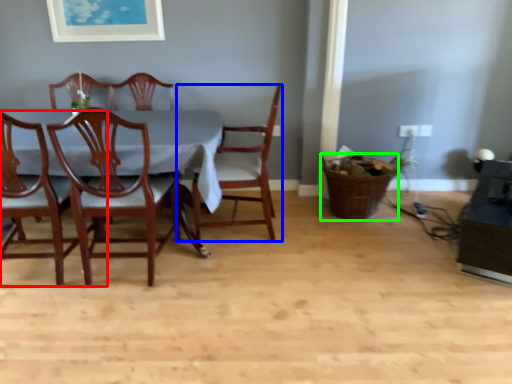
Question: Which object is the farthest from chair (highlighted by a red box)? Choose among these: chair (highlighted by a blue box) or basket (highlighted by a green box).

Choices:
 (A) chair
 (B) basket

Answer: (B)